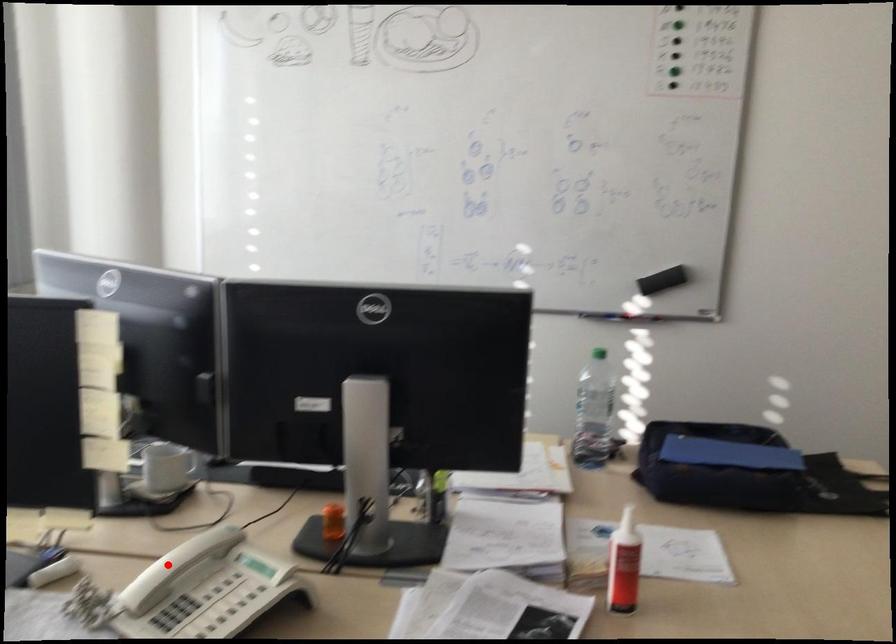
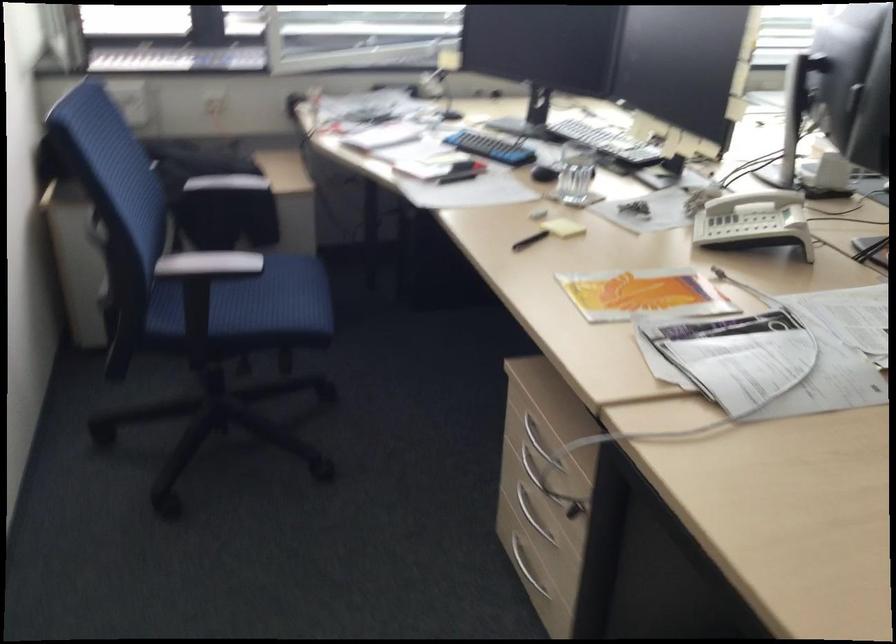
Question: A red point is marked in image1. In image2, is the corresponding 3D point closer to the camera or farther? Reply with the corresponding letter.

Choices:
 (A) The corresponding 3D point is closer.
 (B) The corresponding 3D point is farther.

Answer: (B)